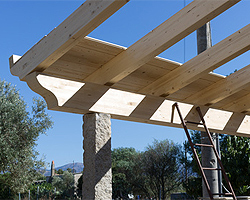
The height and width of the screenshot is (200, 250). I want to click on leftmost beam, so click(x=65, y=29).